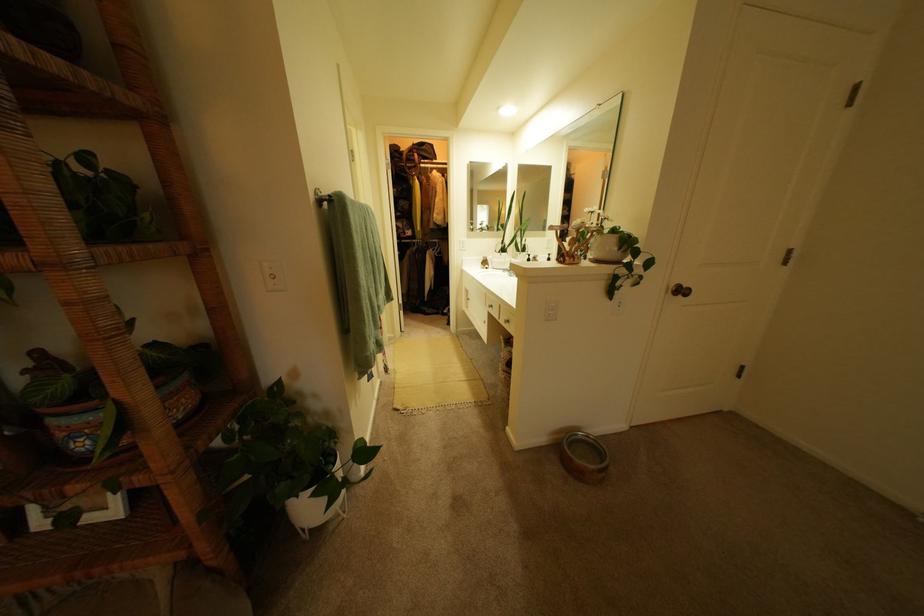
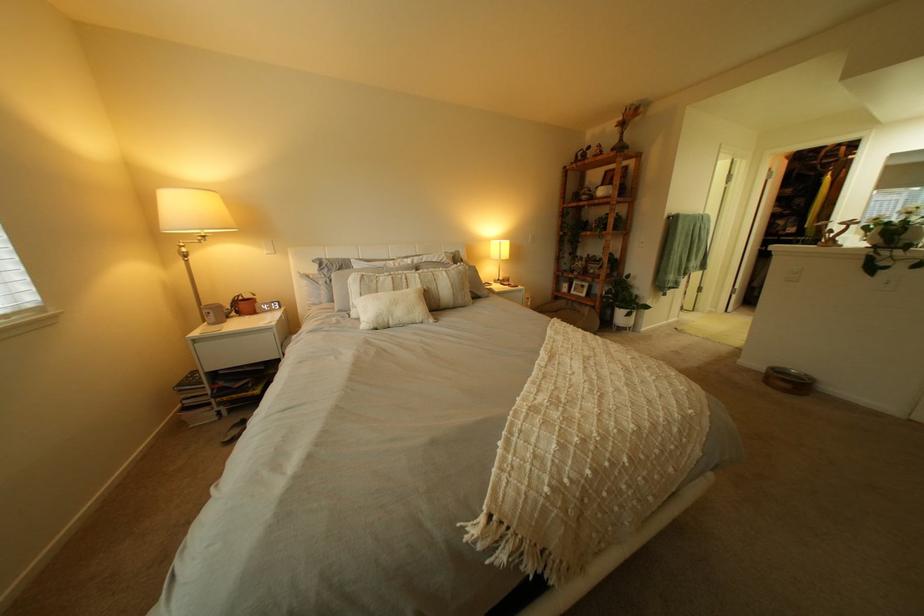
Locate, in the second image, the point that corresponds to point (297, 488) in the first image.

(633, 305)